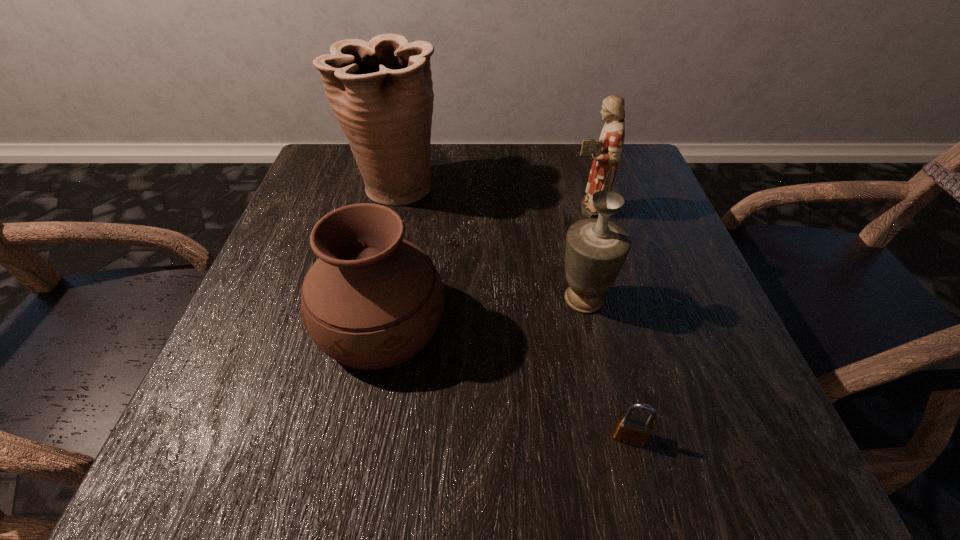
Image resolution: width=960 pixels, height=540 pixels. In the image, there is a desktop. What are the coordinates of `vacant region at the left edge` in the screenshot? It's located at [243, 367].

Identify the location of free space at the right edge. (728, 369).

In the image, there is a desktop. Where is `free region at the far left corner`? The height and width of the screenshot is (540, 960). free region at the far left corner is located at coordinates (316, 181).

Find the location of `vacant space at the near left corner`. vacant space at the near left corner is located at coordinates (242, 481).

Find the location of `vacant area that lies between the rightmost urn and the farthest urn`. vacant area that lies between the rightmost urn and the farthest urn is located at coordinates (490, 244).

Locate an element on the screen. The width and height of the screenshot is (960, 540). free space between the figurine and the nearest object is located at coordinates (608, 322).

Find the location of a particular element. free area in between the shortest object and the tallest object is located at coordinates pyautogui.click(x=512, y=312).

Identify the location of free space between the figurine and the farthest urn. (491, 198).

What are the coordinates of `free space between the shortest object and the rightmost urn` in the screenshot? It's located at (607, 368).

Locate which object ranks fourth in proximity to the figurine. Please provide its 2D coordinates. Your answer should be formatted as a tuple, i.e. [(x, y)], where the tuple contains the x and y coordinates of a point satisfying the conditions above.

[(633, 429)]